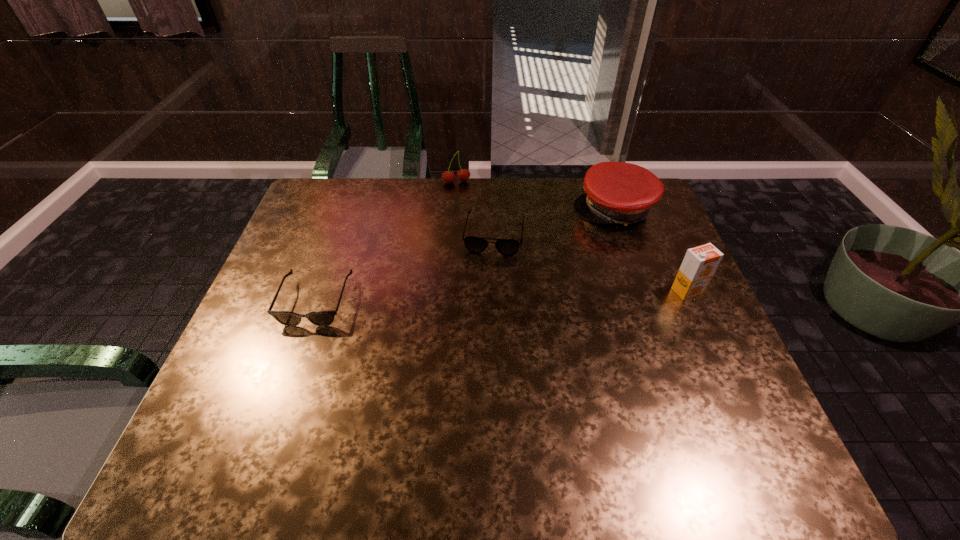
Where is `free space located 0.250m on the front-facing side of the spectacles`? Image resolution: width=960 pixels, height=540 pixels. free space located 0.250m on the front-facing side of the spectacles is located at coordinates (481, 324).

You are a GUI agent. You are given a task and a screenshot of the screen. Output one action in this format:
    pyautogui.click(x=<x>, y=<y>)
    Task: Click on the free region located 0.230m on the front-facing side of the spectacles
    
    Given the screenshot: What is the action you would take?
    pyautogui.click(x=482, y=318)

The width and height of the screenshot is (960, 540). In order to click on blank area located 0.190m on the front-facing side of the spectacles in this screenshot , I will do `click(484, 306)`.

You are a GUI agent. You are given a task and a screenshot of the screen. Output one action in this format:
    pyautogui.click(x=<x>, y=<y>)
    Task: Click on the free space located 0.360m at the front of the cap where the visor is located
    
    Given the screenshot: What is the action you would take?
    pyautogui.click(x=505, y=282)

The image size is (960, 540). What are the coordinates of `vacant space situated at the front of the cap where the visor is located` in the screenshot? It's located at (520, 272).

The height and width of the screenshot is (540, 960). What are the coordinates of `vacant position located 0.110m at the front of the cap where the visor is located` in the screenshot? It's located at (565, 241).

Identify the location of cherry at the far edge. (463, 175).

Find the location of `spectacles located in the far edge section of the desktop`. spectacles located in the far edge section of the desktop is located at coordinates click(508, 247).

This screenshot has height=540, width=960. In order to click on cap located at the far edge in this screenshot , I will do `click(616, 192)`.

Locate an element on the screen. Image resolution: width=960 pixels, height=540 pixels. object present at the left edge is located at coordinates (320, 318).